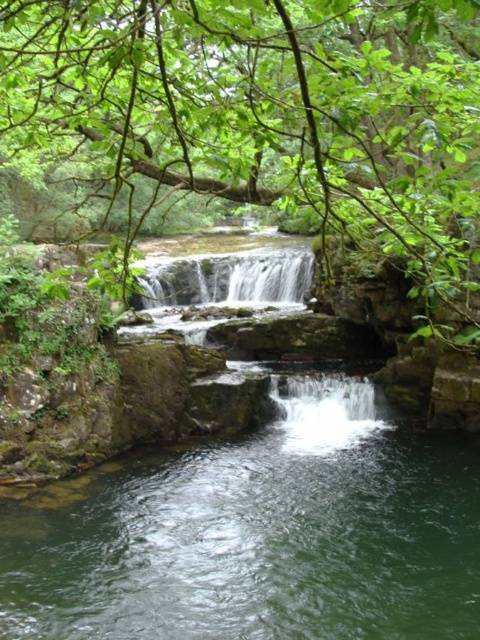
You are standing at the edge of the dark green pool below the waterfall. You see the clear water at center and the green leafy tree at center. Which object is closer to you?

The clear water at center is closer to you because it is positioned below the green leafy tree at center.

You are standing near the waterfall and want to cross the stream using a small wooden plank. The plank is 1.2 meters long. Can you use it to cross the stream between the clear water at center and the white smooth waterfall at center?

The clear water at center might be wider than white smooth waterfall at center. Since the plank is 1.2 meters long, it might not be long enough if the clear water at center is wider than the white smooth waterfall at center. Therefore, it is uncertain whether the plank can be used to cross the stream safely.